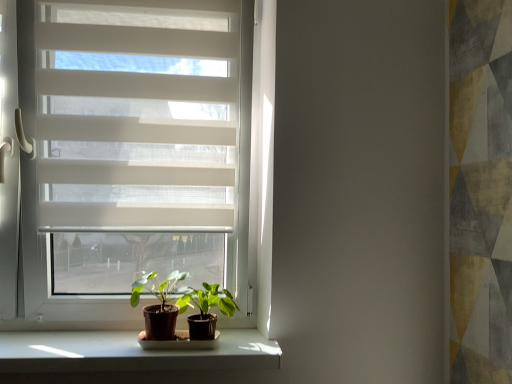
Question: Relative to green matte plant at center, the second houseplant positioned from the left, is white translucent blinds at upper left in front or behind?

Choices:
 (A) behind
 (B) front

Answer: (A)

Question: From the image's perspective, is white translucent blinds at upper left above or below green matte plant at center, which appears as the first houseplant when viewed from the right?

Choices:
 (A) above
 (B) below

Answer: (A)

Question: Which is farther from the white translucent blinds at upper left?

Choices:
 (A) green matte plant at center, which appears as the first houseplant when viewed from the right
 (B) white smooth window sill at lower center
 (C) green matte plant at center, which is the 1th houseplant from left to right
 (D) brown matte pot at lower center
 (E) white matte window at center

Answer: (D)

Question: Which is nearer to the green matte plant at center, the second houseplant positioned from the left?

Choices:
 (A) white translucent blinds at upper left
 (B) white smooth window sill at lower center
 (C) brown matte pot at lower center
 (D) white matte window at center
 (E) green matte plant at center, arranged as the second houseplant when viewed from the right

Answer: (E)